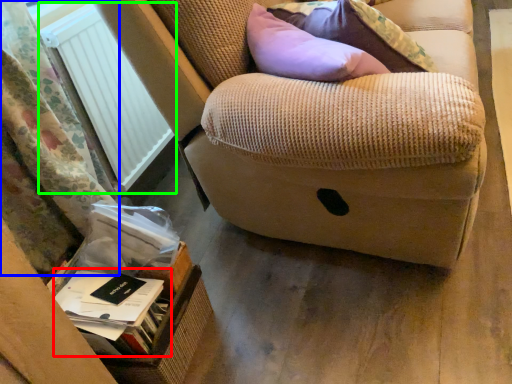
Question: Which object is the farthest from paperback book (highlighted by a red box)? Choose among these: curtain (highlighted by a blue box) or radiator (highlighted by a green box).

Choices:
 (A) curtain
 (B) radiator

Answer: (B)